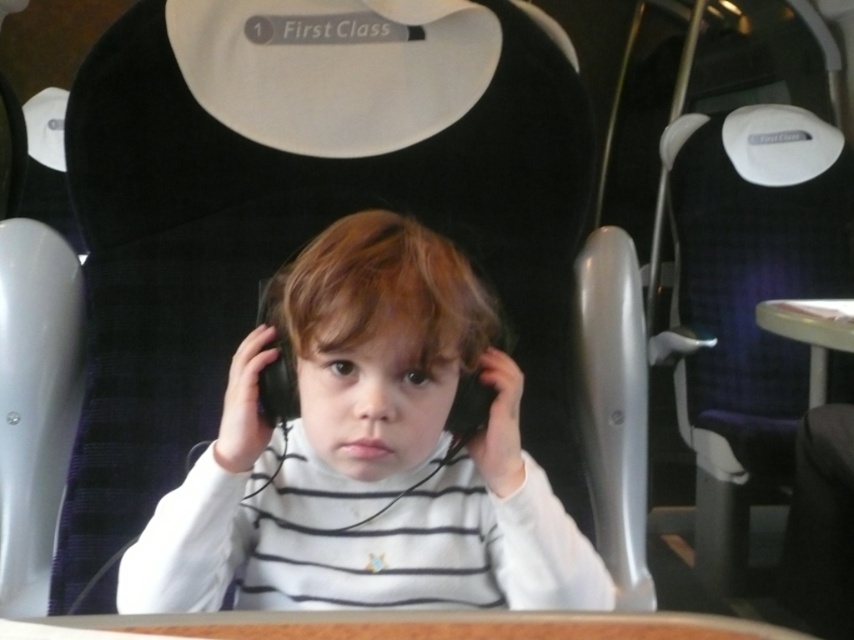
Is brown wood table at center closer to the viewer compared to black matte headphones at center?

Yes, brown wood table at center is in front of black matte headphones at center.

Between point (718, 630) and point (275, 301), which one is positioned behind?

The point (275, 301) is more distant.

Locate an element on the screen. brown wood table at center is located at coordinates (398, 627).

Measure the distance between point (683, 118) and camera.

A distance of 2.26 meters exists between point (683, 118) and camera.

Who is taller, purple fabric chair at center or brown wood table at center?

With more height is purple fabric chair at center.

Who is more distant from viewer, (771,401) or (199,628)?

Point (771,401)

What are the coordinates of `purple fabric chair at center` in the screenshot? It's located at (749, 300).

Does white matte headphones at center come behind purple fabric chair at center?

No, white matte headphones at center is in front of purple fabric chair at center.

Between white matte headphones at center and purple fabric chair at center, which one appears on the left side from the viewer's perspective?

white matte headphones at center

Describe the element at coordinates (367, 456) in the screenshot. I see `white matte headphones at center` at that location.

Where is `white matte headphones at center`? This screenshot has width=854, height=640. white matte headphones at center is located at coordinates (367, 456).